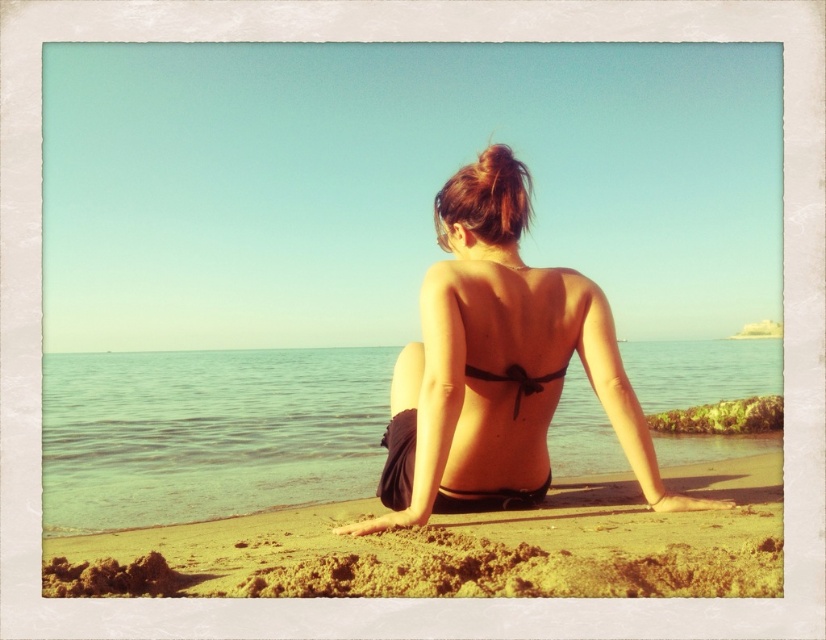
Between clear water at center and black matte bikini top at center, which one is positioned higher?

black matte bikini top at center is higher up.

Which of these two, clear water at center or black matte bikini top at center, stands taller?

black matte bikini top at center is taller.

Who is more forward, (124,472) or (445,452)?

Point (445,452) is more forward.

Identify the location of clear water at center. The height and width of the screenshot is (640, 826). (207, 433).

Between point (552, 548) and point (525, 394), which one is positioned behind?

Positioned behind is point (525, 394).

Is fine-grained sand at lower center taller than black satin bikini top at center?

No, fine-grained sand at lower center is not taller than black satin bikini top at center.

The image size is (826, 640). What are the coordinates of `fine-grained sand at lower center` in the screenshot? It's located at (457, 547).

Which of these two, clear water at center or black satin bikini top at center, stands taller?

clear water at center

Looking at this image, can you confirm if clear water at center is bigger than black satin bikini top at center?

Indeed, clear water at center has a larger size compared to black satin bikini top at center.

The image size is (826, 640). What are the coordinates of `clear water at center` in the screenshot? It's located at (207, 433).